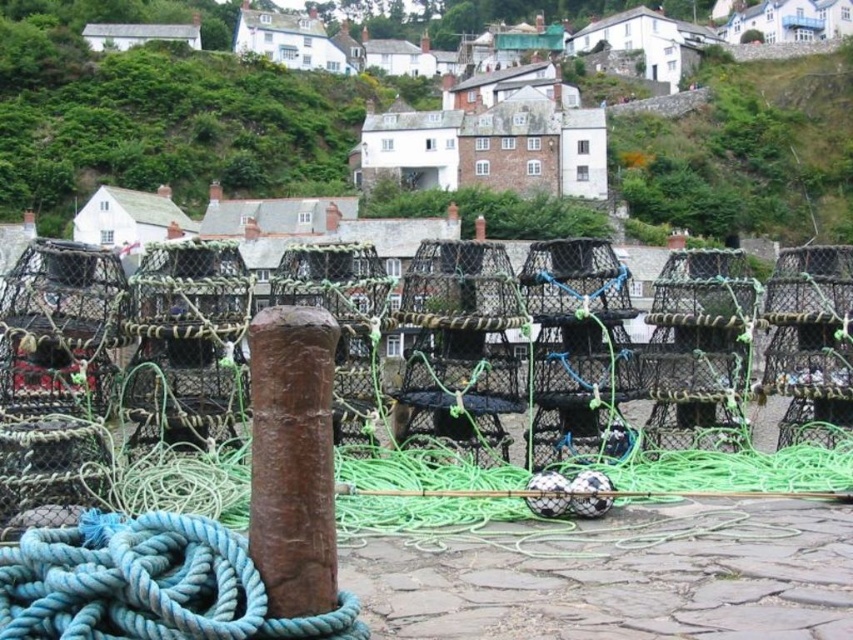
Between blue rope at lower left and rusty wood post at center, which one is positioned lower?

blue rope at lower left is lower down.

Is blue rope at lower left to the left of rusty wood post at center from the viewer's perspective?

Yes, blue rope at lower left is to the left of rusty wood post at center.

Describe the element at coordinates (148, 584) in the screenshot. Image resolution: width=853 pixels, height=640 pixels. I see `blue rope at lower left` at that location.

This screenshot has width=853, height=640. I want to click on blue rope at lower left, so click(148, 584).